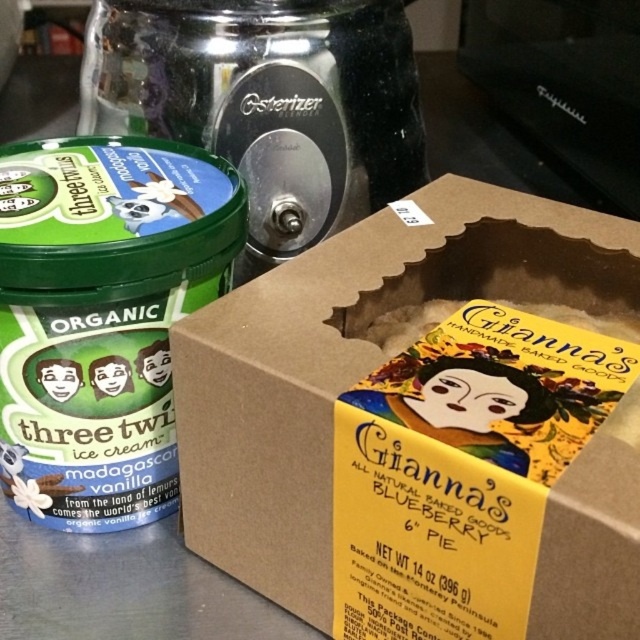
You are organizing items on a narrow kitchen shelf that can only hold items up to 20 cm in width. You have the brown cardboard box at center and the green matte ice cream container at left. Which item should you place first to ensure both fit on the shelf?

The brown cardboard box at center is wider than the green matte ice cream container at left. To fit both on the shelf, place the narrower green matte ice cream container at left first, then the brown cardboard box at center, as their combined width may not exceed 20 cm if arranged properly.

Consider the image. You are a chef organizing items on a kitchen counter. You need to place a new item between the brown cardboard box at center and the green matte ice cream container at left. Based on their positions, where should you place the new item to ensure it is between them?

Since the brown cardboard box at center is closer to the viewer than the green matte ice cream container at left, placing the new item between them would require positioning it closer to the brown cardboard box at center but still in front of the green matte ice cream container at left.